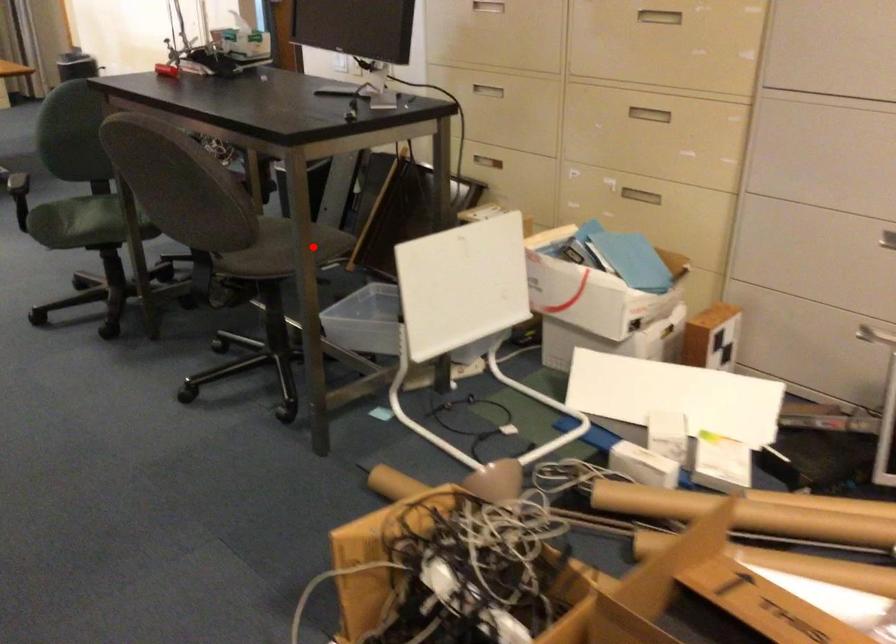
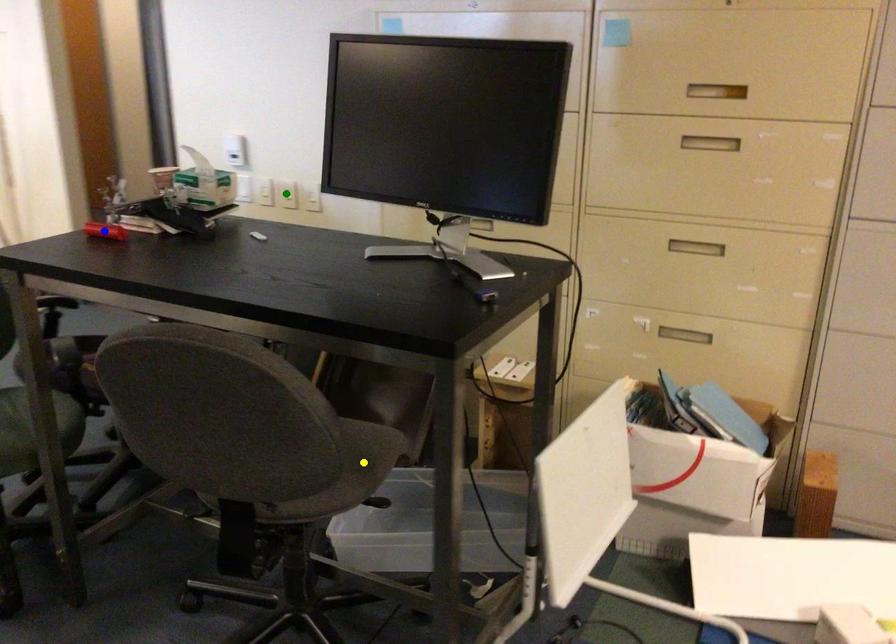
Question: I am providing you with two images of the same scene from different viewpoints. A red point is marked on the first image. You are given multiple points on the second image. Can you choose the point in image 2 that corresponds to the point in image 1?

Choices:
 (A) yellow point
 (B) blue point
 (C) green point

Answer: (A)